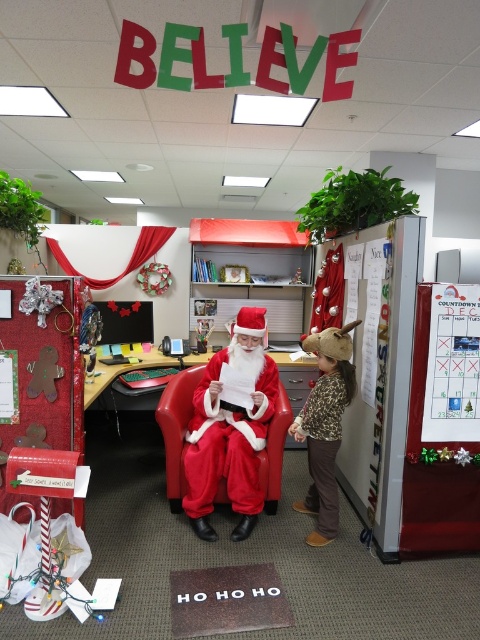
Question: Which object is farther from the camera taking this photo?

Choices:
 (A) fuzzy red santa at center
 (B) leopard print sweater at center

Answer: (A)

Question: Does fuzzy red santa at center appear under leopard print sweater at center?

Choices:
 (A) yes
 (B) no

Answer: (B)

Question: Which point is closer to the camera taking this photo?

Choices:
 (A) (210, 468)
 (B) (335, 480)

Answer: (A)

Question: Which object appears closest to the camera in this image?

Choices:
 (A) leopard print sweater at center
 (B) fuzzy red santa at center

Answer: (A)

Question: Is fuzzy red santa at center bigger than leopard print sweater at center?

Choices:
 (A) no
 (B) yes

Answer: (B)

Question: Does fuzzy red santa at center have a lesser width compared to leopard print sweater at center?

Choices:
 (A) no
 (B) yes

Answer: (A)